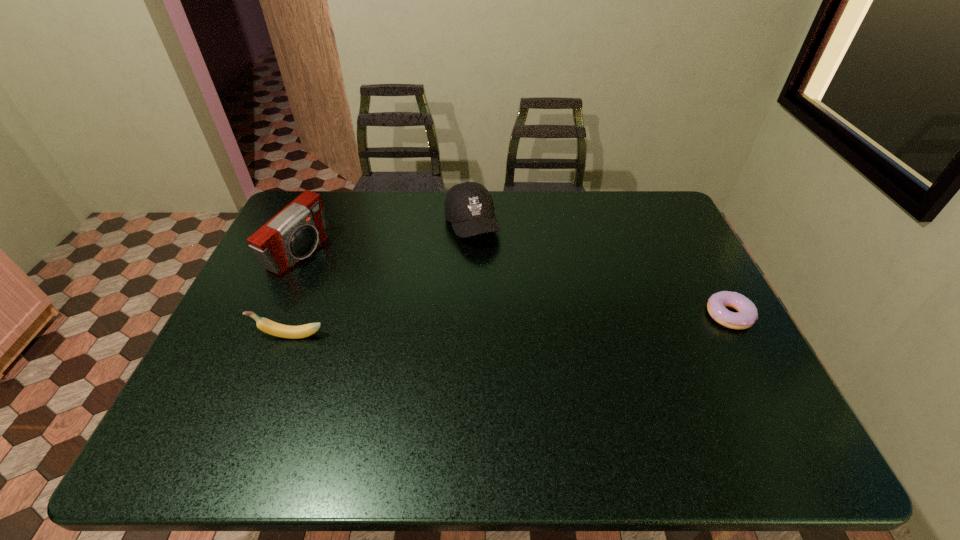
You are a GUI agent. You are given a task and a screenshot of the screen. Output one action in this format:
    pyautogui.click(x=<x>, y=<y>)
    Task: Click on the free space located 0.160m on the front-facing side of the third shortest object
    
    Given the screenshot: What is the action you would take?
    pyautogui.click(x=494, y=284)

I want to click on vacant region located 0.230m on the front-facing side of the camera, so point(377,294).

Find the location of a particular element. vacant region located on the front-facing side of the camera is located at coordinates (350, 281).

This screenshot has height=540, width=960. I want to click on blank space located on the front-facing side of the camera, so click(x=388, y=299).

Where is `baseball cap present at the far edge`? The image size is (960, 540). baseball cap present at the far edge is located at coordinates (469, 207).

At what (x,y) coordinates should I click in order to perform the action: click on camera present at the far edge. Please return your answer as a coordinate pair (x, y). Looking at the image, I should click on (293, 234).

The width and height of the screenshot is (960, 540). I want to click on banana at the left edge, so point(268,326).

What are the coordinates of `camera that is at the left edge` in the screenshot? It's located at point(293,234).

The width and height of the screenshot is (960, 540). Identify the location of object positioned at the right edge. (747, 314).

Locate an element on the screen. This screenshot has width=960, height=540. object located at the far left corner is located at coordinates (293, 234).